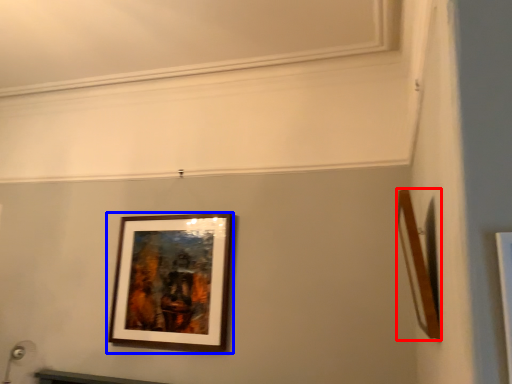
Question: Among these objects, which one is nearest to the camera, picture frame (highlighted by a red box) or picture frame (highlighted by a blue box)?

Choices:
 (A) picture frame
 (B) picture frame

Answer: (A)